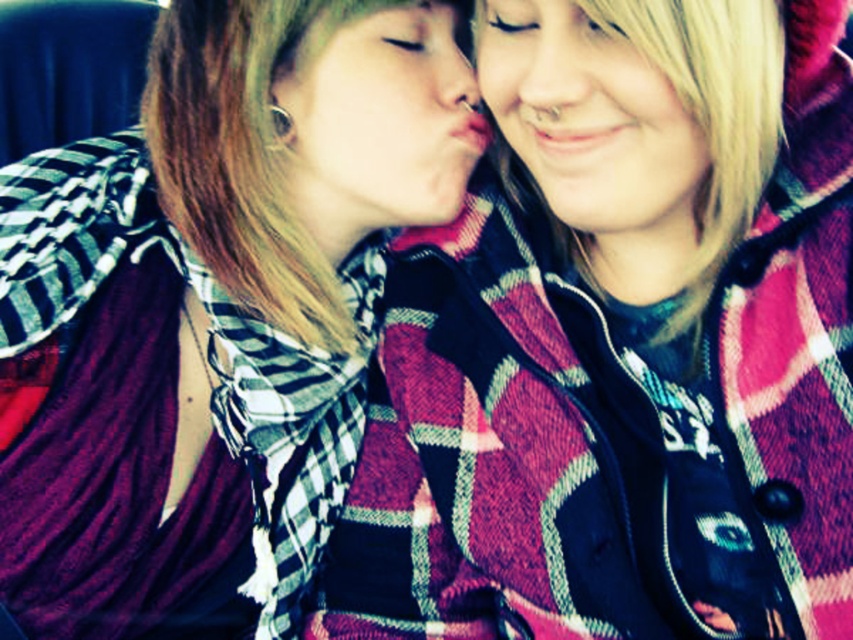
From the picture: Does blonde hair at upper right have a lesser height compared to matte plaid shirt at center?

Yes.

Does blonde hair at upper right appear on the left side of matte plaid shirt at center?

In fact, blonde hair at upper right is to the right of matte plaid shirt at center.

Find the location of `blonde hair at upper right`. blonde hair at upper right is located at coordinates (590, 120).

Is plaid fabric jacket at center further to camera compared to matte plaid shirt at center?

No, plaid fabric jacket at center is in front of matte plaid shirt at center.

Who is taller, plaid fabric jacket at center or matte plaid shirt at center?

Standing taller between the two is plaid fabric jacket at center.

Image resolution: width=853 pixels, height=640 pixels. What are the coordinates of `plaid fabric jacket at center` in the screenshot? It's located at (606, 419).

Where is `plaid fabric jacket at center`? plaid fabric jacket at center is located at coordinates (606, 419).

Does plaid fabric shirt at center appear over matte plaid shirt at center?

No.

Who is higher up, plaid fabric shirt at center or matte plaid shirt at center?

matte plaid shirt at center is higher up.

Measure the distance between point (247, 509) and camera.

The distance of point (247, 509) from camera is 39.03 inches.

In order to click on plaid fabric shirt at center in this screenshot , I will do `click(213, 310)`.